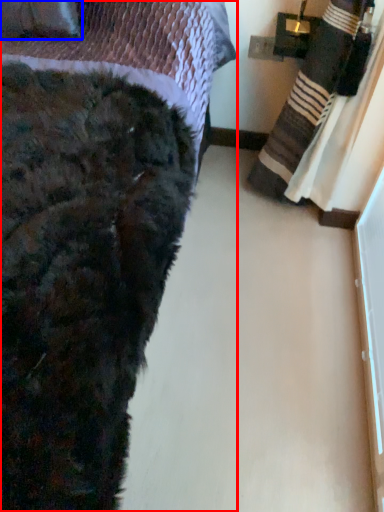
Question: Which object is further to the camera taking this photo, bed (highlighted by a red box) or throw pillow (highlighted by a blue box)?

Choices:
 (A) bed
 (B) throw pillow

Answer: (B)